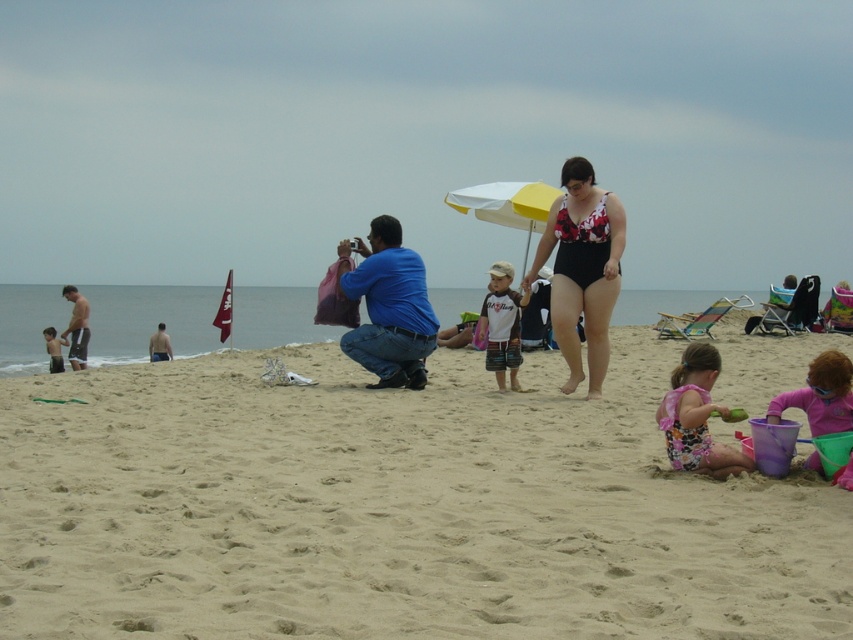
You are a photographer standing on the beach. You want to take a photo of the black swimsuit at center without any shadows. Since the yellow matte umbrella at center is casting a shadow, where should you position yourself relative to the umbrella to avoid the shadow?

The black swimsuit at center is below the yellow matte umbrella at center, so positioning yourself on the opposite side of the umbrella from where the shadow is cast would ensure the photo is shadow free.